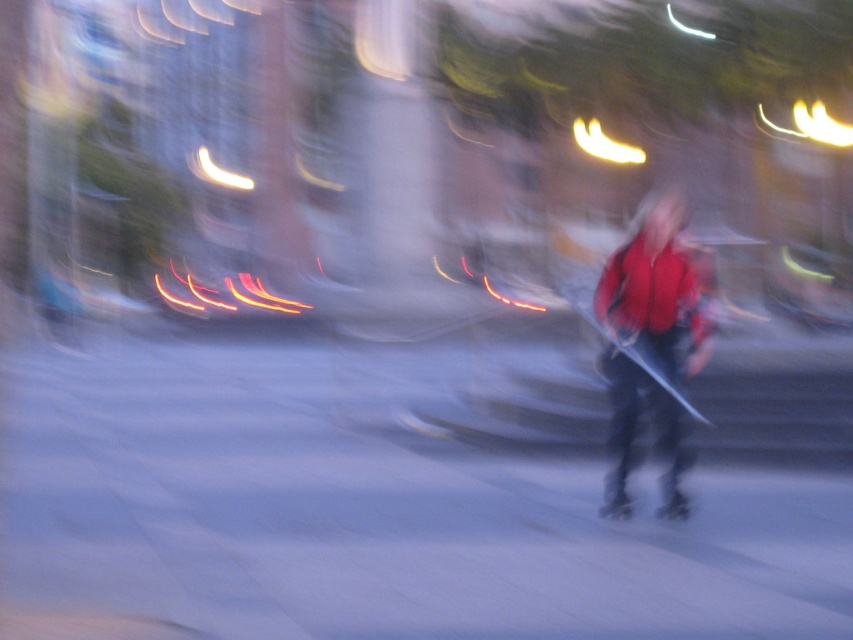
You are a delivery person trying to place a small package on the ground. The package is exactly the same size as the shiny black roller skate at center. Based on the scene, can you fit the package on the gray asphalt at center without it overlapping the roller skate?

The gray asphalt at center is wider than the shiny black roller skate at center, so yes, you can place the package on the gray asphalt at center without overlapping the roller skate as long as you position it appropriately.

You are standing at the point with coordinates point (685, 516) and want to walk towards the point with coordinates point (643, 404). Will you be moving towards a location that is closer to the foreground or the background of the image?

Point (643, 404) is in front of point (685, 516), so moving towards it means you are heading toward a location closer to the foreground of the image.